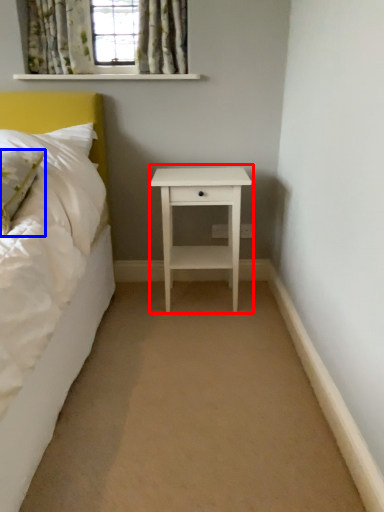
Question: Which point is closer to the camera, nightstand (highlighted by a red box) or pillow (highlighted by a blue box)?

Choices:
 (A) nightstand
 (B) pillow

Answer: (B)